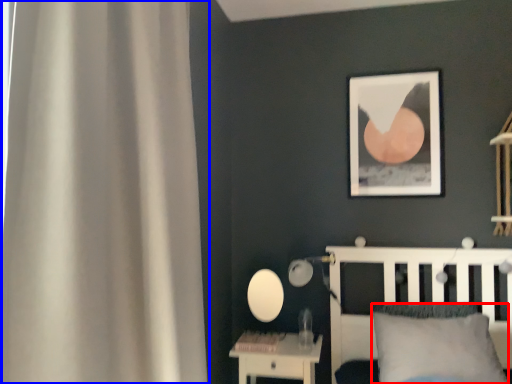
Question: Which object appears closest to the camera in this image, pillow (highlighted by a red box) or curtain (highlighted by a blue box)?

Choices:
 (A) pillow
 (B) curtain

Answer: (B)